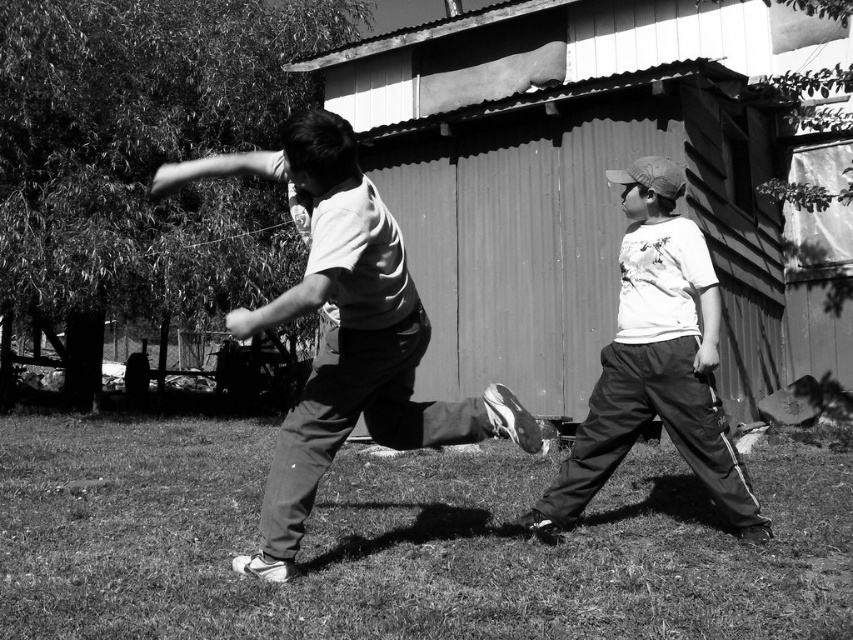
Based on the photo, between matte white shirt at center and white matte shirt at center, which one appears on the right side from the viewer's perspective?

white matte shirt at center is more to the right.

Is matte white shirt at center smaller than white matte shirt at center?

No.

At what (x,y) coordinates should I click in order to perform the action: click on matte white shirt at center. Please return your answer as a coordinate pair (x, y). This screenshot has height=640, width=853. Looking at the image, I should click on (343, 330).

Is green grass at center further to camera compared to white matte shirt at center?

Yes, green grass at center is further from the viewer.

Between green grass at center and white matte shirt at center, which one has less height?

green grass at center

This screenshot has height=640, width=853. What do you see at coordinates (399, 544) in the screenshot? I see `green grass at center` at bounding box center [399, 544].

I want to click on green grass at center, so click(399, 544).

Identify the location of green grass at center. (399, 544).

Looking at this image, can you confirm if green grass at center is smaller than matte white shirt at center?

Indeed, green grass at center has a smaller size compared to matte white shirt at center.

Consider the image. Measure the distance between green grass at center and camera.

green grass at center is 17.92 feet from camera.

The image size is (853, 640). I want to click on green grass at center, so click(399, 544).